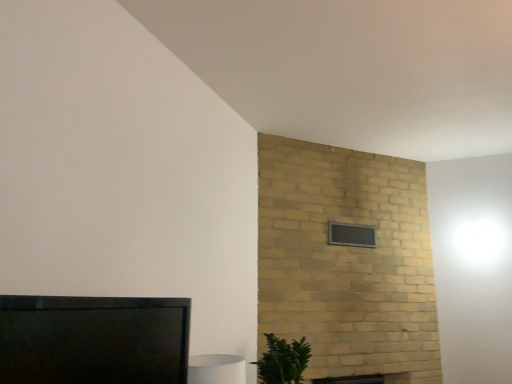
Question: Would you say matte black tv at lower left contains black glass window at upper center?

Choices:
 (A) no
 (B) yes

Answer: (A)

Question: Is matte black tv at lower left closer to the viewer compared to black glass window at upper center?

Choices:
 (A) no
 (B) yes

Answer: (B)

Question: Is matte black tv at lower left outside of black glass window at upper center?

Choices:
 (A) no
 (B) yes

Answer: (B)

Question: Does matte black tv at lower left lie behind black glass window at upper center?

Choices:
 (A) no
 (B) yes

Answer: (A)

Question: From the image's perspective, would you say matte black tv at lower left is shown under black glass window at upper center?

Choices:
 (A) no
 (B) yes

Answer: (B)

Question: Is matte black tv at lower left taller than black glass window at upper center?

Choices:
 (A) yes
 (B) no

Answer: (A)

Question: From a real-world perspective, is matte black tv at lower left below green leafy plant at lower right?

Choices:
 (A) yes
 (B) no

Answer: (B)

Question: Are matte black tv at lower left and green leafy plant at lower right beside each other?

Choices:
 (A) yes
 (B) no

Answer: (B)

Question: Is matte black tv at lower left not close to green leafy plant at lower right?

Choices:
 (A) yes
 (B) no

Answer: (A)

Question: Does matte black tv at lower left have a lesser width compared to green leafy plant at lower right?

Choices:
 (A) yes
 (B) no

Answer: (A)

Question: Considering the relative sizes of matte black tv at lower left and green leafy plant at lower right in the image provided, is matte black tv at lower left wider than green leafy plant at lower right?

Choices:
 (A) no
 (B) yes

Answer: (A)

Question: Can you confirm if matte black tv at lower left is positioned to the right of green leafy plant at lower right?

Choices:
 (A) no
 (B) yes

Answer: (A)

Question: Is black glass window at upper center to the left of matte black tv at lower left from the viewer's perspective?

Choices:
 (A) no
 (B) yes

Answer: (A)